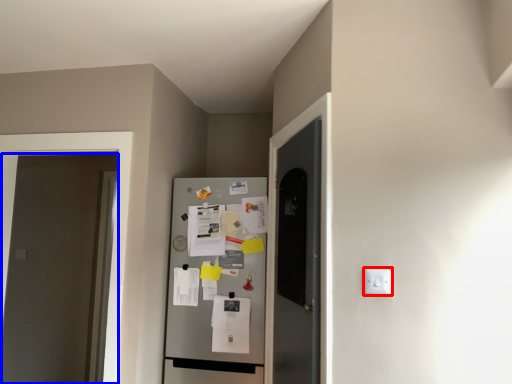
Question: Which point is closer to the camera, electric outlet (highlighted by a red box) or door (highlighted by a blue box)?

Choices:
 (A) electric outlet
 (B) door

Answer: (A)